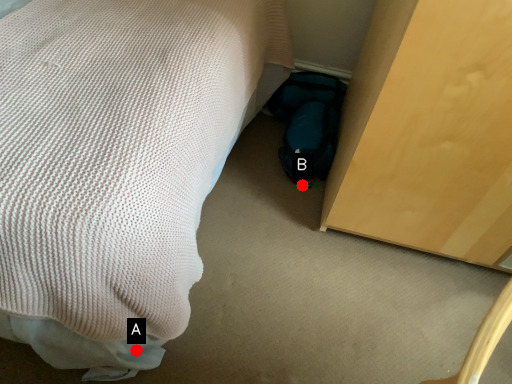
Question: Two points are circled on the image, labeled by A and B beside each circle. Among these points, which one is farthest from the camera?

Choices:
 (A) A is further
 (B) B is further

Answer: (B)